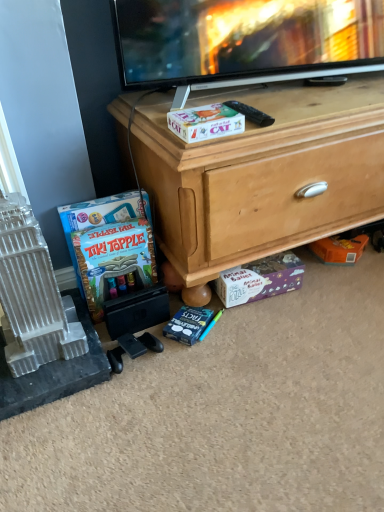
Question: Considering the relative sizes of matte board game at lower left and white plastic building at left in the image provided, is matte board game at lower left shorter than white plastic building at left?

Choices:
 (A) no
 (B) yes

Answer: (B)

Question: Does matte board game at lower left lie in front of white plastic building at left?

Choices:
 (A) yes
 (B) no

Answer: (B)

Question: Can you confirm if matte board game at lower left is bigger than white plastic building at left?

Choices:
 (A) no
 (B) yes

Answer: (A)

Question: Is matte board game at lower left with white plastic building at left?

Choices:
 (A) no
 (B) yes

Answer: (A)

Question: Considering the relative positions of matte board game at lower left and white plastic building at left in the image provided, is matte board game at lower left behind white plastic building at left?

Choices:
 (A) yes
 (B) no

Answer: (A)

Question: Is point (223, 300) closer or farther from the camera than point (233, 105)?

Choices:
 (A) farther
 (B) closer

Answer: (A)

Question: In terms of height, does purple cardboard puzzle box at lower center look taller or shorter compared to black plastic remote control at upper center?

Choices:
 (A) tall
 (B) short

Answer: (A)

Question: In the image, is purple cardboard puzzle box at lower center positioned in front of or behind black plastic remote control at upper center?

Choices:
 (A) front
 (B) behind

Answer: (B)

Question: Is purple cardboard puzzle box at lower center inside or outside of black plastic remote control at upper center?

Choices:
 (A) outside
 (B) inside

Answer: (A)

Question: From a real-world perspective, relative to wooden chest at center, is matte board game at lower left vertically above or below?

Choices:
 (A) below
 (B) above

Answer: (A)

Question: Considering the positions of matte board game at lower left and wooden chest at center in the image, is matte board game at lower left bigger or smaller than wooden chest at center?

Choices:
 (A) big
 (B) small

Answer: (B)

Question: In the image, is matte board game at lower left positioned in front of or behind wooden chest at center?

Choices:
 (A) behind
 (B) front

Answer: (A)

Question: From the image's perspective, is matte board game at lower left located above or below wooden chest at center?

Choices:
 (A) below
 (B) above

Answer: (A)

Question: Is white plastic building at left taller or shorter than wooden chest at center?

Choices:
 (A) tall
 (B) short

Answer: (B)

Question: Does point (23, 220) appear closer or farther from the camera than point (231, 91)?

Choices:
 (A) farther
 (B) closer

Answer: (B)